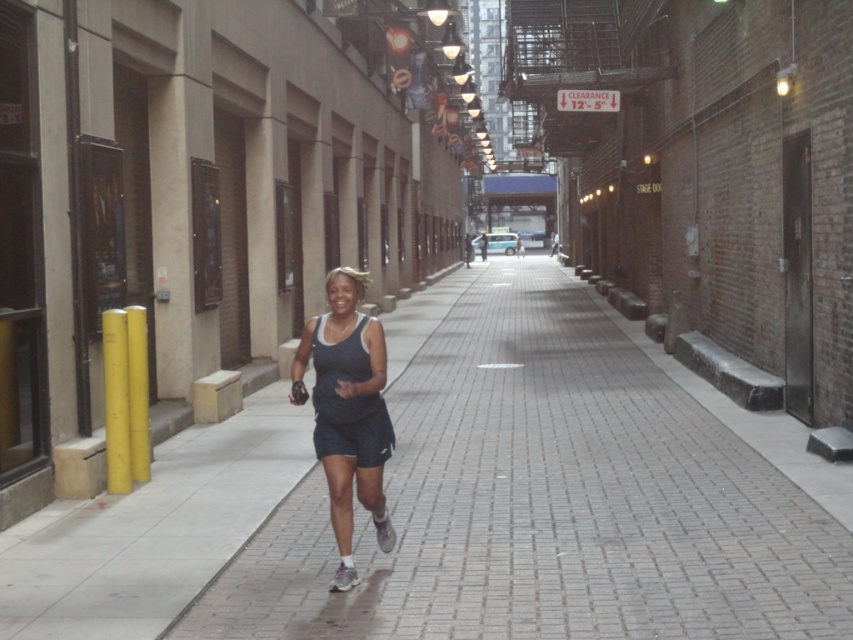
Between brick pavement at center and dark blue fabric tank top at center, which one appears on the left side from the viewer's perspective?

dark blue fabric tank top at center is more to the left.

Can you confirm if brick pavement at center is shorter than dark blue fabric tank top at center?

Yes, brick pavement at center is shorter than dark blue fabric tank top at center.

I want to click on brick pavement at center, so (548, 500).

Identify the location of brick pavement at center. (548, 500).